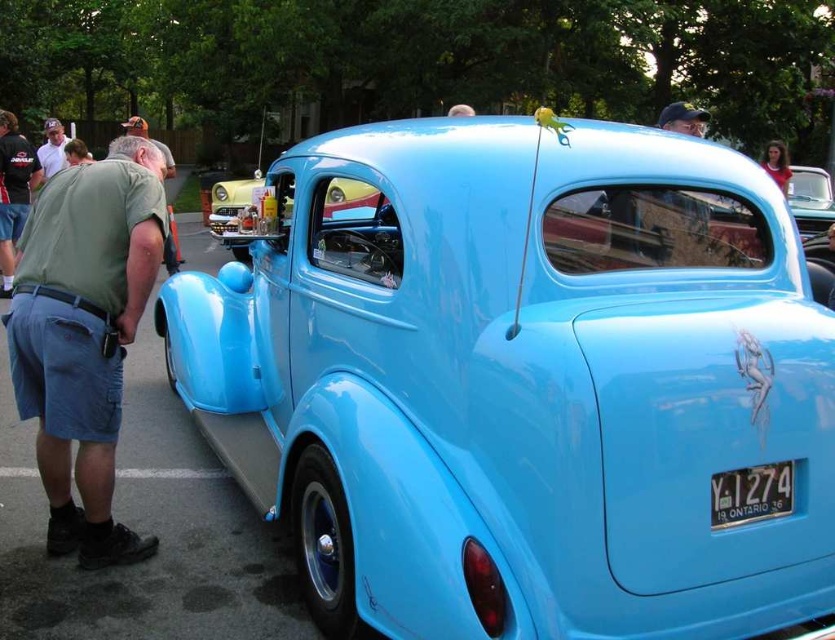
Question: Which object is the closest to the green cotton shirt at left?

Choices:
 (A) smooth skin at upper right
 (B) glossy metallic car at center
 (C) matte green shirt at upper left
 (D) black metal/license plate at lower right

Answer: (B)

Question: Does glossy metallic car at center come in front of matte black cap at upper center?

Choices:
 (A) yes
 (B) no

Answer: (A)

Question: In this image, where is glossy metallic car at center located relative to matte green shirt at upper left?

Choices:
 (A) below
 (B) above

Answer: (A)

Question: Which is nearer to the smooth skin at upper right?

Choices:
 (A) matte black cap at upper center
 (B) glossy metallic car at center
 (C) matte green shirt at upper left

Answer: (B)

Question: Estimate the real-world distances between objects in this image. Which object is farther from the matte black cap at upper center?

Choices:
 (A) green cotton shirt at left
 (B) matte green shirt at upper left
 (C) smooth skin at upper right
 (D) black metal/license plate at lower right

Answer: (B)

Question: From the image, what is the correct spatial relationship of green cotton shirt at left in relation to matte black cap at upper center?

Choices:
 (A) right
 (B) left

Answer: (B)